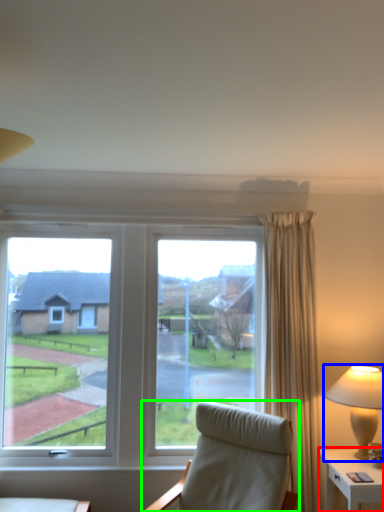
Question: Which is farther away from nightstand (highlighted by a red box)? lamp (highlighted by a blue box) or chair (highlighted by a green box)?

Choices:
 (A) lamp
 (B) chair

Answer: (B)